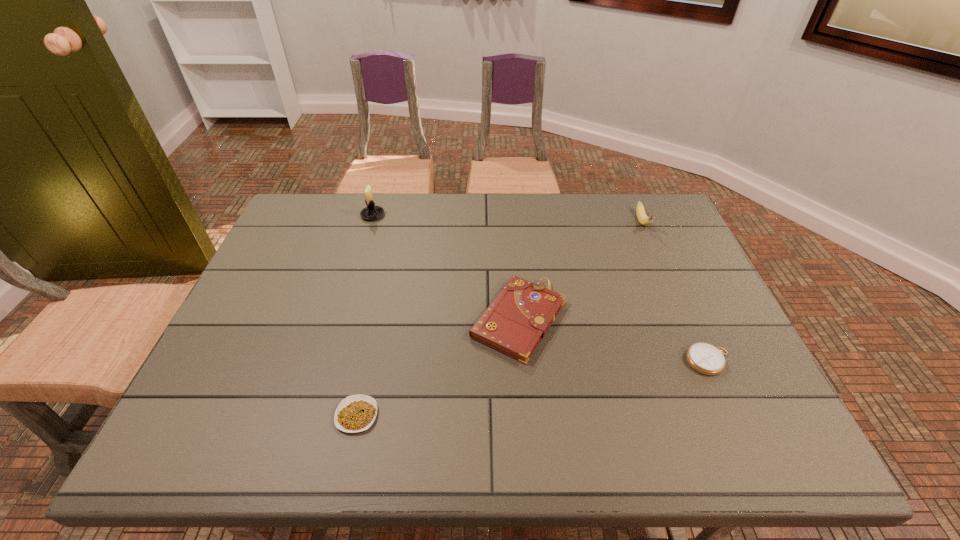
This screenshot has height=540, width=960. What are the coordinates of `vacant region between the fourth shortest object and the third shortest object` in the screenshot? It's located at (581, 271).

Locate an element on the screen. This screenshot has height=540, width=960. vacant area that lies between the third shortest object and the leftmost object is located at coordinates (445, 267).

Where is `vacant space that's between the third object from right to left and the compass`? The image size is (960, 540). vacant space that's between the third object from right to left and the compass is located at coordinates (613, 340).

Where is `the closest object relative to the compass`? This screenshot has width=960, height=540. the closest object relative to the compass is located at coordinates (518, 318).

Point out which object is positioned as the third nearest to the compass. Please provide its 2D coordinates. Your answer should be formatted as a tuple, i.e. [(x, y)], where the tuple contains the x and y coordinates of a point satisfying the conditions above.

[(356, 413)]

At what (x,y) coordinates should I click in order to perform the action: click on free location that satisfies the following two spatial constraints: 1. on the front side of the tallest object; 2. on the left side of the legume. Please return your answer as a coordinate pair (x, y). The width and height of the screenshot is (960, 540). Looking at the image, I should click on (314, 415).